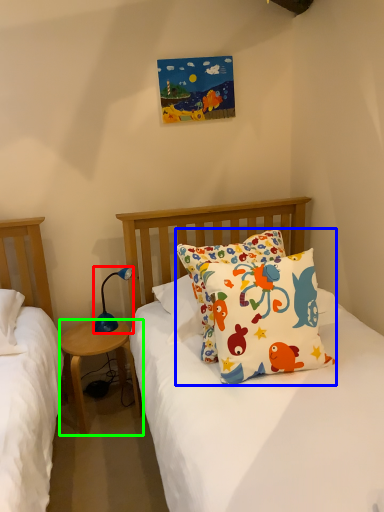
Question: Which is nearer to the lamp (highlighted by a red box)? pillow (highlighted by a blue box) or nightstand (highlighted by a green box).

Choices:
 (A) pillow
 (B) nightstand

Answer: (B)